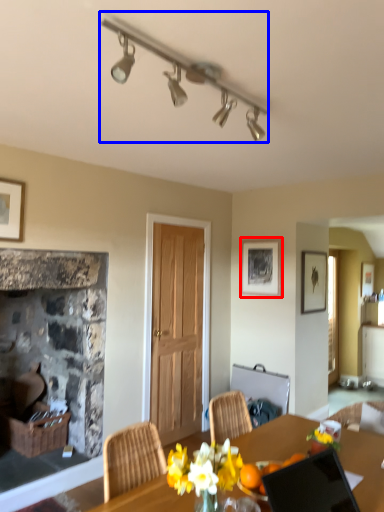
Question: Which object is further to the camera taking this photo, picture frame (highlighted by a red box) or lamp (highlighted by a blue box)?

Choices:
 (A) picture frame
 (B) lamp

Answer: (A)